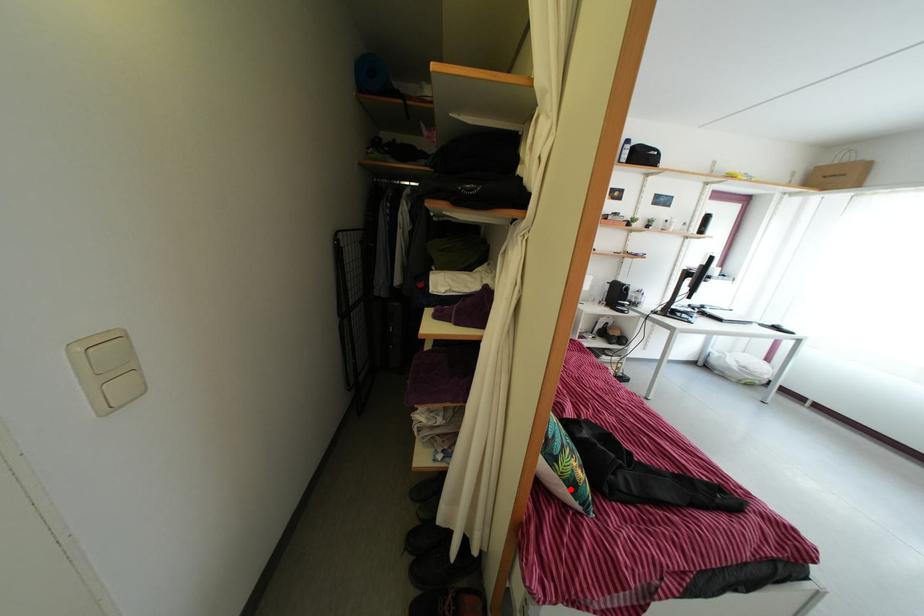
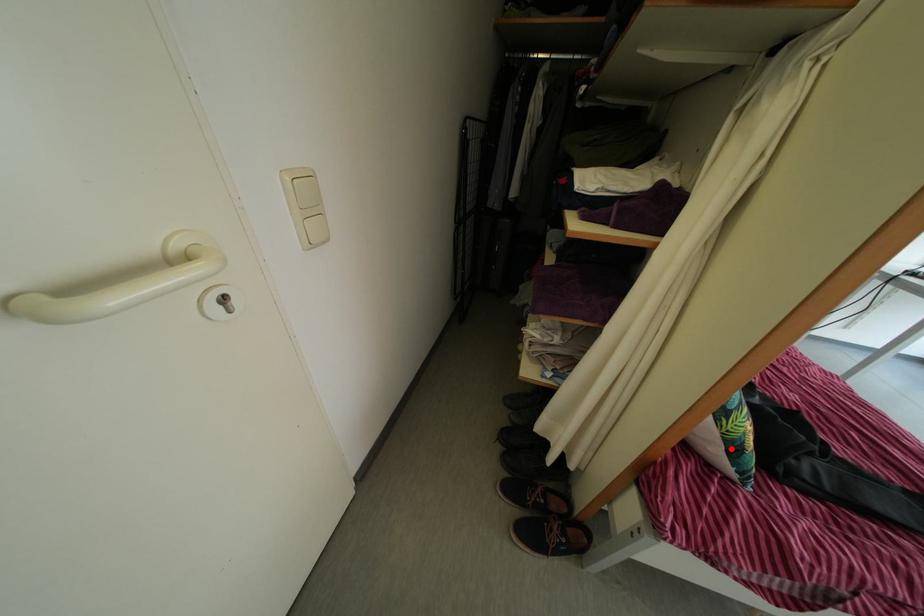
I am providing you with two images of the same scene from different viewpoints. A red point is marked on the first image and another point is marked on the second image. Are the points marked in image1 and image2 representing the same 3D position?

Yes